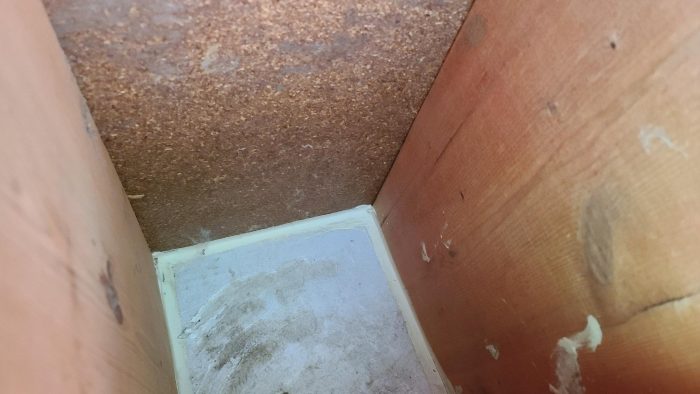
Locate an element on the screen. The image size is (700, 394). black crack in wood panel is located at coordinates (665, 301).